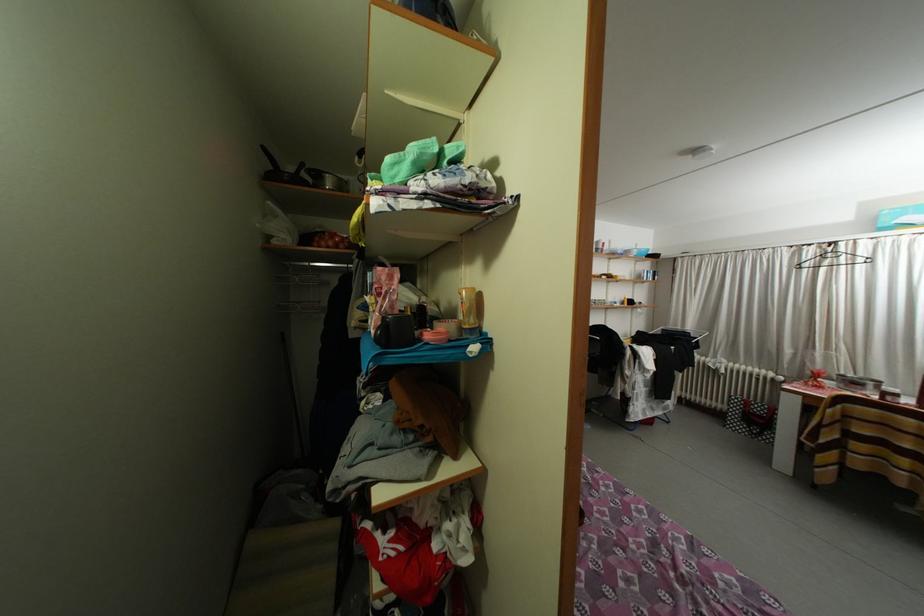
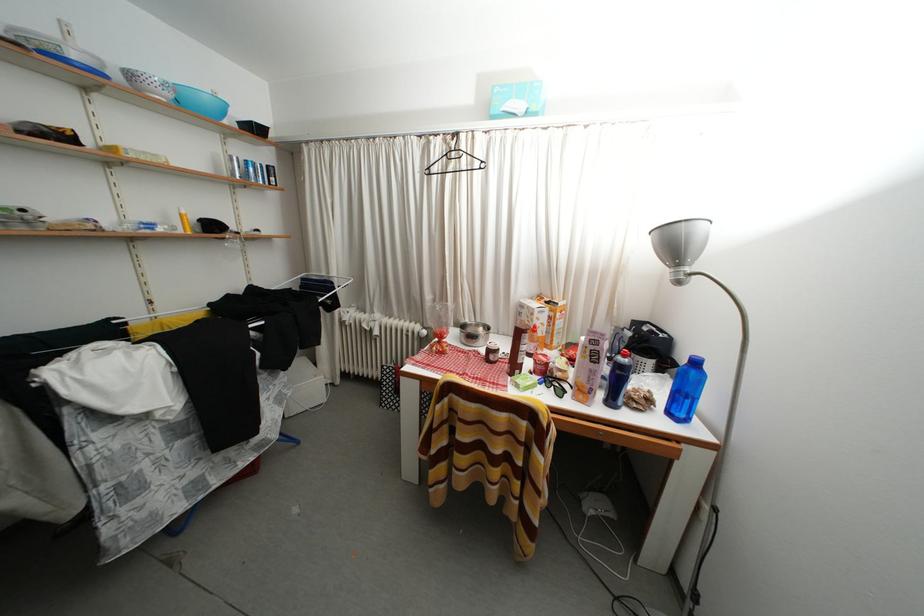
In the second image, find the point that corresponds to pixel 627 257 in the first image.

(81, 61)